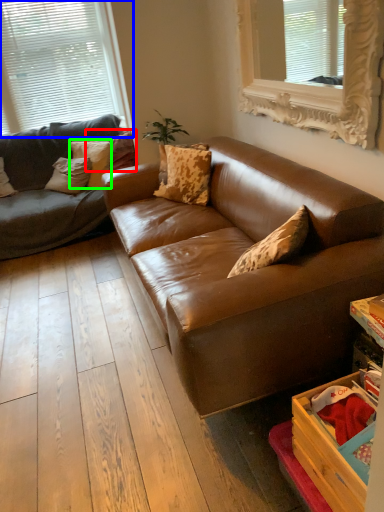
Question: Estimate the real-world distances between objects in this image. Which object is farther from pillow (highlighted by a red box), window (highlighted by a blue box) or pillow (highlighted by a green box)?

Choices:
 (A) window
 (B) pillow

Answer: (A)